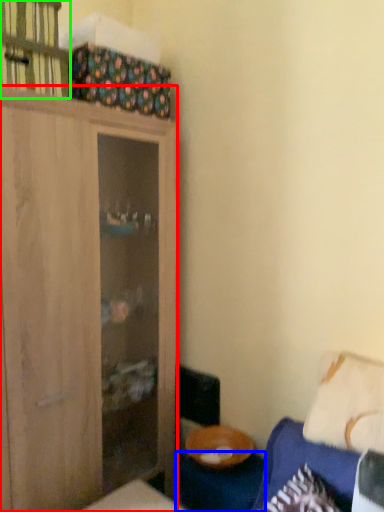
Question: Considering the real-world distances, which object is closest to cabinetry (highlighted by a red box)? table (highlighted by a blue box) or cabinet (highlighted by a green box).

Choices:
 (A) table
 (B) cabinet

Answer: (B)